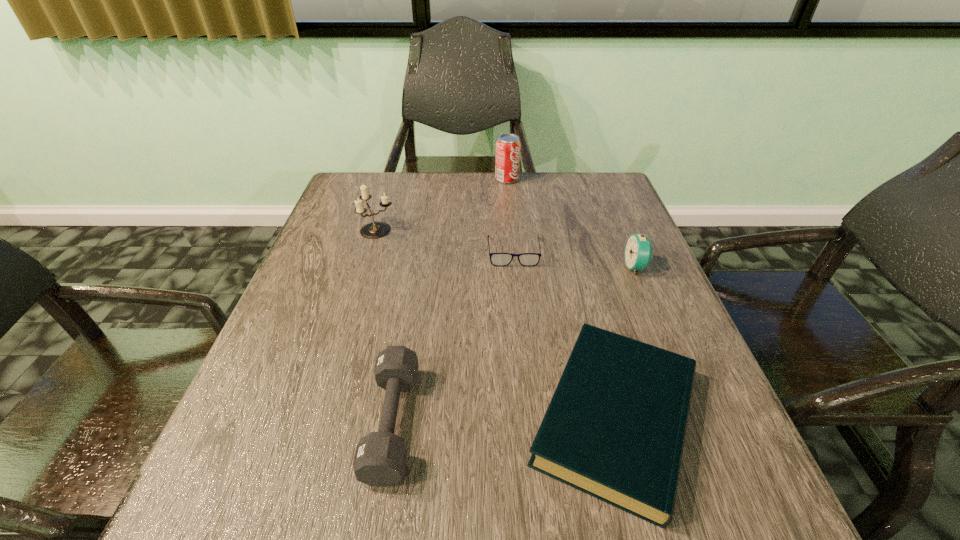
Where is `the farthest object`? the farthest object is located at coordinates (507, 160).

Where is `candle holder`? This screenshot has height=540, width=960. candle holder is located at coordinates (374, 230).

You are a GUI agent. You are given a task and a screenshot of the screen. Output one action in this format:
    pyautogui.click(x=<x>, y=<y>)
    Task: Click on the third tallest object
    The width and height of the screenshot is (960, 540).
    Given the screenshot: What is the action you would take?
    pyautogui.click(x=638, y=253)

Where is `the third shortest object`? This screenshot has height=540, width=960. the third shortest object is located at coordinates (380, 459).

At what (x,y) coordinates should I click in order to perform the action: click on dumbbell. Please return your answer as a coordinate pair (x, y). Looking at the image, I should click on (380, 459).

Find the location of a particular element. book is located at coordinates (615, 427).

Locate an element on the screen. Image resolution: width=960 pixels, height=540 pixels. spectacles is located at coordinates (497, 259).

The image size is (960, 540). What are the coordinates of `free spot located on the right of the soda can` in the screenshot? It's located at (580, 179).

At what (x,y) coordinates should I click in order to perform the action: click on free region located on the back of the leftmost object. Please return your answer as a coordinate pair (x, y). The height and width of the screenshot is (540, 960). Looking at the image, I should click on (395, 174).

Find the location of a particular element. vacant space located 0.220m on the front-facing side of the fourth shortest object is located at coordinates (532, 267).